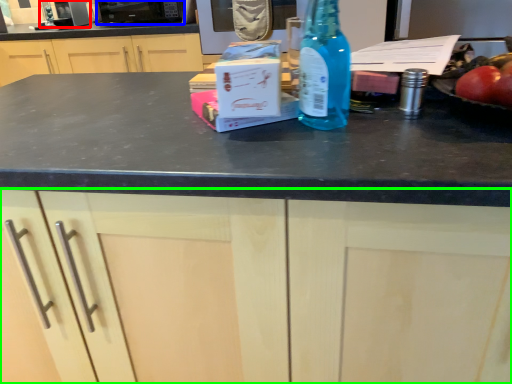
Question: Which object is positioned farthest from appliance (highlighted by a red box)? Select from appliance (highlighted by a blue box) and cabinetry (highlighted by a green box).

Choices:
 (A) appliance
 (B) cabinetry

Answer: (B)